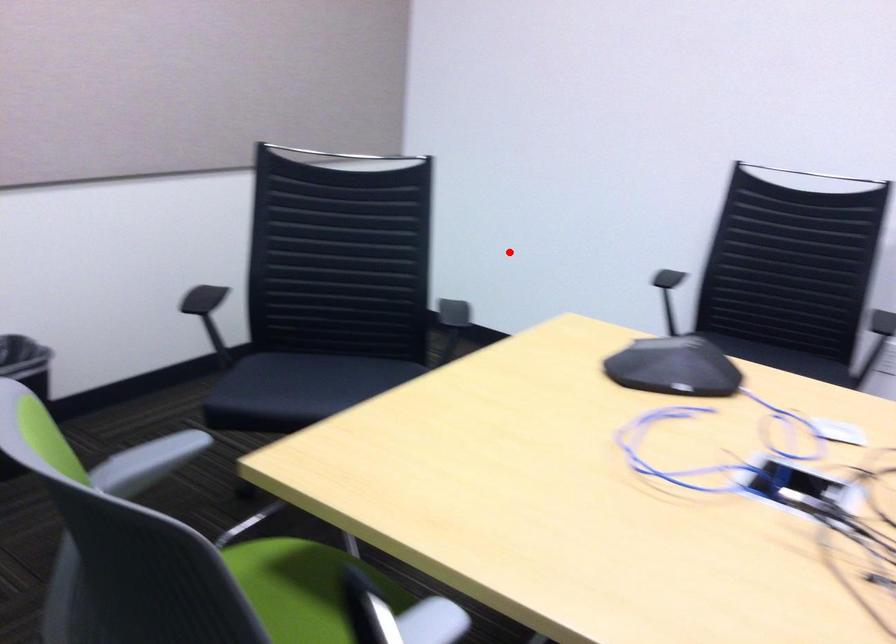
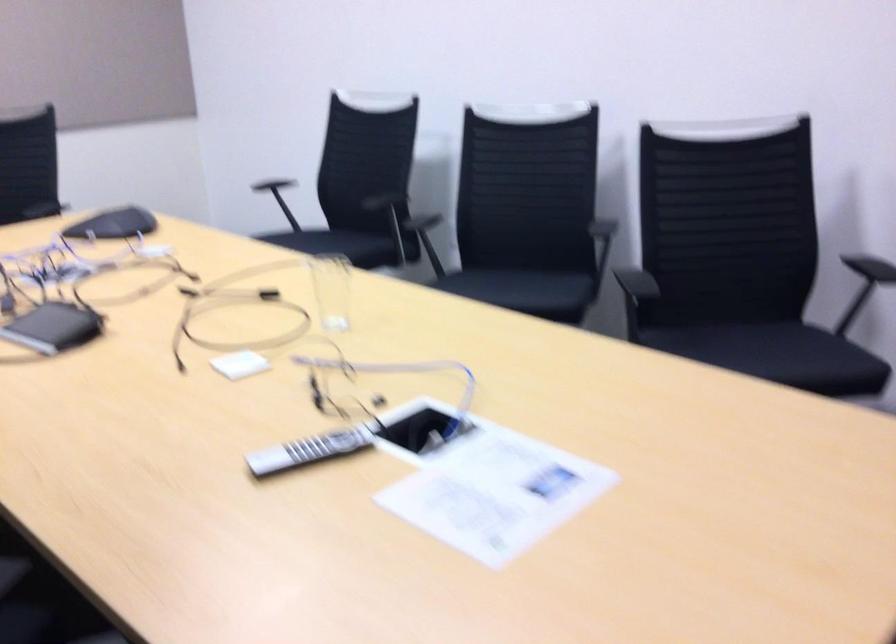
Question: A red point is marked in image1. In image2, is the corresponding 3D point closer to the camera or farther? Reply with the corresponding letter.

Choices:
 (A) The corresponding 3D point is closer.
 (B) The corresponding 3D point is farther.

Answer: (B)